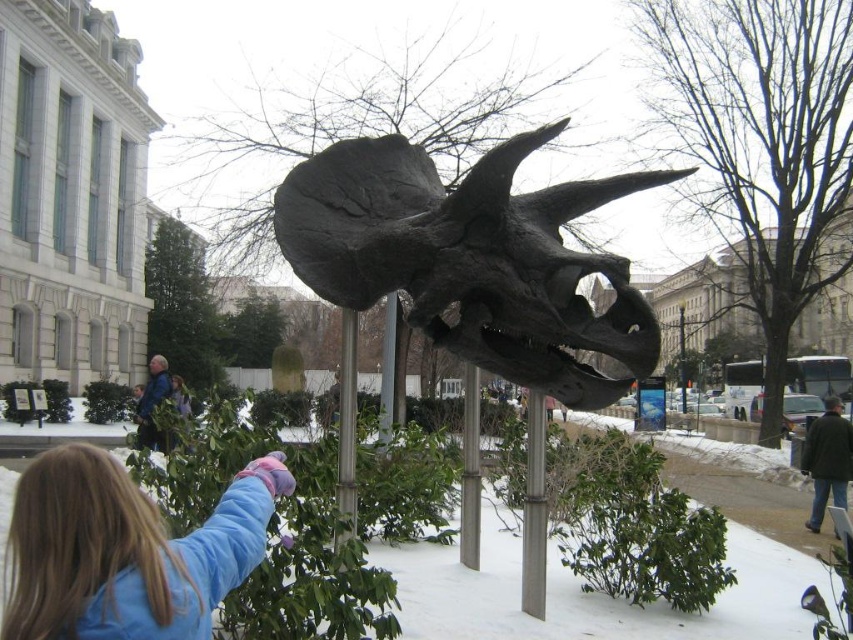
Question: Does blue fleece jacket at lower left have a greater width compared to metallic silver pole at center?

Choices:
 (A) yes
 (B) no

Answer: (A)

Question: Which point is closer to the camera?

Choices:
 (A) (392, 317)
 (B) (543, 452)

Answer: (B)

Question: Is metallic silver pole at center bigger than silver metallic pole at center?

Choices:
 (A) no
 (B) yes

Answer: (B)

Question: Which point appears closest to the camera in this image?

Choices:
 (A) (479, 413)
 (B) (61, 467)
 (C) (527, 566)
 (D) (392, 324)

Answer: (B)

Question: Considering the real-world distances, which object is closest to the gray metallic pole at center?

Choices:
 (A) dark gray metallic skull at center
 (B) metallic silver pole at center
 (C) silver metallic pole at center
 (D) metallic gray pole at center

Answer: (A)

Question: Where is dark gray metallic skull at center located in relation to metallic silver pole at center in the image?

Choices:
 (A) above
 (B) below

Answer: (A)